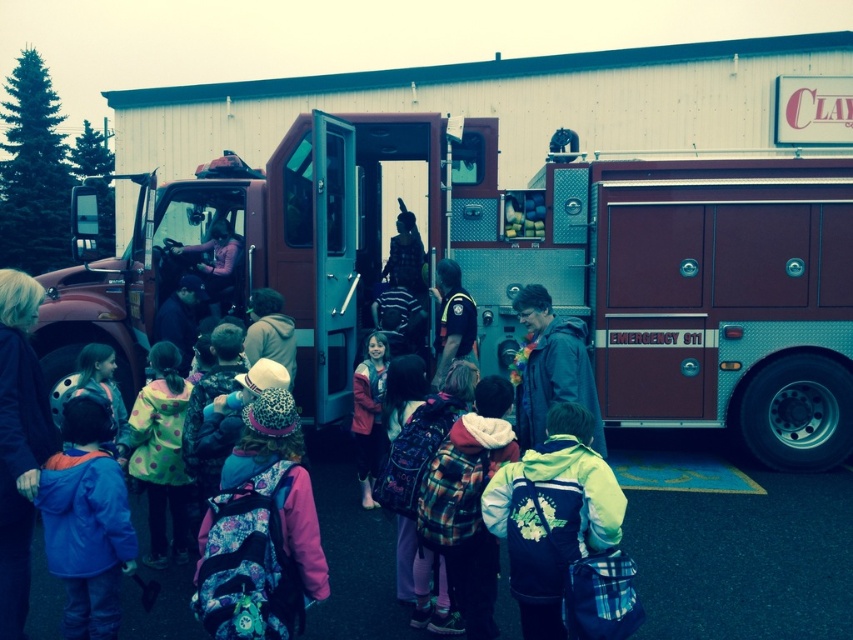
You are a photographer trying to capture a group photo of the children and adults near the fire truck. You need to ensure that both the blue fleece jacket at lower left and the polka dot fabric jacket at center are visible in the frame. Considering their sizes, which jacket might require you to adjust your camera angle to ensure it is fully captured?

The polka dot fabric jacket at center is wider than the blue fleece jacket at lower left, so you might need to adjust your camera angle to ensure the polka dot fabric jacket at center is fully visible in the photo.